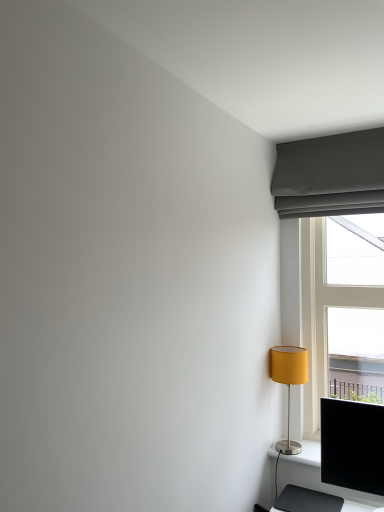
You are a GUI agent. You are given a task and a screenshot of the screen. Output one action in this format:
    pyautogui.click(x=<x>, y=<y>)
    Task: Click on the white plastic window at right
    This screenshot has width=384, height=512.
    Given the screenshot: What is the action you would take?
    (x=332, y=244)

Where is `black glossy computer monitor at lower right`? black glossy computer monitor at lower right is located at coordinates (353, 447).

Is matte gray curtain at upper right not close to white plastic window at right?

No, matte gray curtain at upper right is in close proximity to white plastic window at right.

You are a GUI agent. You are given a task and a screenshot of the screen. Output one action in this format:
    pyautogui.click(x=<x>, y=<y>)
    Task: Click on the window below the matte gray curtain at upper right (from a real-world perspective)
    The width and height of the screenshot is (384, 512).
    Given the screenshot: What is the action you would take?
    pos(332,244)

Considering their positions, is matte gray curtain at upper right located in front of or behind white plastic window at right?

Result: In the image, matte gray curtain at upper right appears in front of white plastic window at right.

Identify the location of computer monitor lying on the right of matte yellow fabric lampshade at right. The width and height of the screenshot is (384, 512). (353, 447).

Between black glossy computer monitor at lower right and matte yellow fabric lampshade at right, which one has smaller width?

Thinner between the two is black glossy computer monitor at lower right.

How different are the orientations of black glossy computer monitor at lower right and matte yellow fabric lampshade at right in degrees?

The angle between the facing direction of black glossy computer monitor at lower right and the facing direction of matte yellow fabric lampshade at right is 0.238 degrees.

In the image, is matte yellow fabric lampshade at right on the left side or the right side of white plastic window at right?

matte yellow fabric lampshade at right is positioned on white plastic window at right's left side.

From a real-world perspective, which is physically below, matte yellow fabric lampshade at right or white plastic window at right?

In real-world perspective, matte yellow fabric lampshade at right is lower.

Could you tell me if matte yellow fabric lampshade at right is facing white plastic window at right?

No, matte yellow fabric lampshade at right does not turn towards white plastic window at right.

Looking at this image, from the image's perspective, is matte yellow fabric lampshade at right over matte gray curtain at upper right?

No, from the image's perspective, matte yellow fabric lampshade at right is not on top of matte gray curtain at upper right.

Identify the location of lamp directly beneath the matte gray curtain at upper right (from a real-world perspective). The height and width of the screenshot is (512, 384). (289, 383).

How much distance is there between matte yellow fabric lampshade at right and matte gray curtain at upper right?

The distance of matte yellow fabric lampshade at right from matte gray curtain at upper right is 30.27 inches.

Does matte yellow fabric lampshade at right have a lesser width compared to matte gray curtain at upper right?

In fact, matte yellow fabric lampshade at right might be wider than matte gray curtain at upper right.

Is point (278, 443) more distant than point (355, 484)?

That is True.

Is matte yellow fabric lampshade at right beside black glossy computer monitor at lower right?

There is a gap between matte yellow fabric lampshade at right and black glossy computer monitor at lower right.

Between matte yellow fabric lampshade at right and black glossy computer monitor at lower right, which one has less height?

With less height is matte yellow fabric lampshade at right.

Identify the location of computer monitor located in front of the matte yellow fabric lampshade at right. 353,447.

From the picture: Considering the sizes of objects white plastic window at right and black glossy computer monitor at lower right in the image provided, who is taller, white plastic window at right or black glossy computer monitor at lower right?

white plastic window at right is taller.

Considering the sizes of objects white plastic window at right and black glossy computer monitor at lower right in the image provided, who is wider, white plastic window at right or black glossy computer monitor at lower right?

With larger width is white plastic window at right.

Considering the relative positions of white plastic window at right and black glossy computer monitor at lower right in the image provided, is white plastic window at right in front of black glossy computer monitor at lower right?

No, white plastic window at right is further to the viewer.

Is white plastic window at right positioned with its back to matte gray curtain at upper right?

No, white plastic window at right is not facing the opposite direction of matte gray curtain at upper right.

Between white plastic window at right and matte gray curtain at upper right, which one has more height?

white plastic window at right is taller.

Is point (319, 246) more distant than point (360, 143)?

Yes, it is.

Are white plastic window at right and matte gray curtain at upper right beside each other?

Absolutely, white plastic window at right is next to and touching matte gray curtain at upper right.

This screenshot has width=384, height=512. In order to click on window on the right of matte gray curtain at upper right in this screenshot , I will do `click(332, 244)`.

Find the location of a particular element. The image size is (384, 512). computer monitor in front of the matte yellow fabric lampshade at right is located at coordinates (353, 447).

From the image, which object appears to be nearer to matte yellow fabric lampshade at right, white plastic window at right or matte gray curtain at upper right?

Among the two, white plastic window at right is located nearer to matte yellow fabric lampshade at right.

From the image, which object appears to be farther from white plastic window at right, matte yellow fabric lampshade at right or black glossy computer monitor at lower right?

The object further to white plastic window at right is black glossy computer monitor at lower right.

Based on the photo, when comparing their distances from matte yellow fabric lampshade at right, does matte gray curtain at upper right or white plastic window at right seem closer?

The object closer to matte yellow fabric lampshade at right is white plastic window at right.

Considering their positions, is matte gray curtain at upper right positioned further to black glossy computer monitor at lower right than matte yellow fabric lampshade at right?

matte gray curtain at upper right.

From the image, which object appears to be farther from black glossy computer monitor at lower right, matte gray curtain at upper right or white plastic window at right?

matte gray curtain at upper right is positioned further to the anchor black glossy computer monitor at lower right.

Consider the image. When comparing their distances from matte gray curtain at upper right, does white plastic window at right or matte yellow fabric lampshade at right seem closer?

white plastic window at right is closer to matte gray curtain at upper right.

Looking at the image, which one is located further to black glossy computer monitor at lower right, white plastic window at right or matte yellow fabric lampshade at right?

Among the two, white plastic window at right is located further to black glossy computer monitor at lower right.

Which object lies nearer to the anchor point white plastic window at right, matte gray curtain at upper right or black glossy computer monitor at lower right?

matte gray curtain at upper right is positioned closer to the anchor white plastic window at right.

This screenshot has width=384, height=512. I want to click on lamp between white plastic window at right and black glossy computer monitor at lower right from top to bottom, so click(289, 383).

At what (x,y) coordinates should I click in order to perform the action: click on lamp that lies between matte gray curtain at upper right and black glossy computer monitor at lower right from top to bottom. Please return your answer as a coordinate pair (x, y). The image size is (384, 512). Looking at the image, I should click on point(289,383).

Locate an element on the screen. window between matte gray curtain at upper right and matte yellow fabric lampshade at right in the up-down direction is located at coordinates (332, 244).

Identify the location of window between matte gray curtain at upper right and black glossy computer monitor at lower right from top to bottom. The width and height of the screenshot is (384, 512). (332, 244).